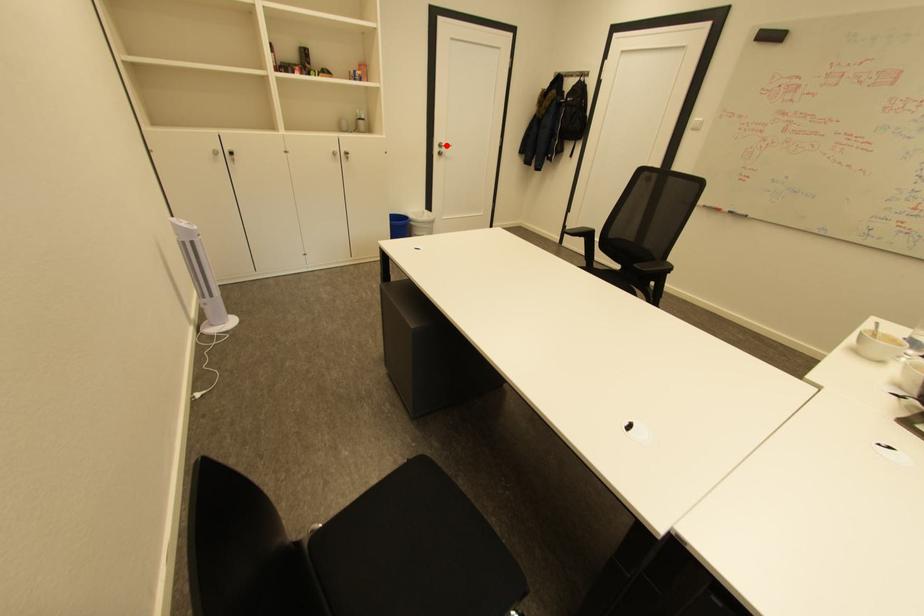
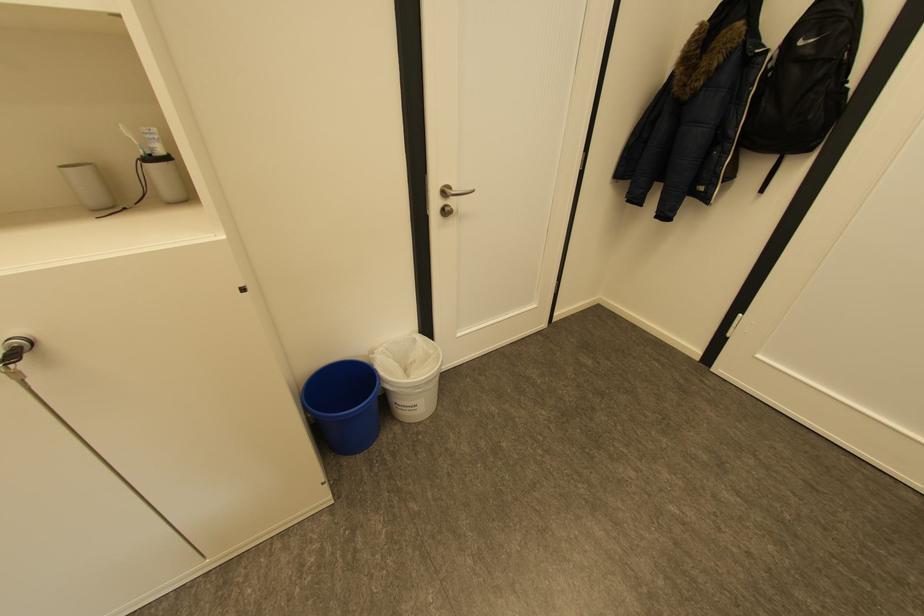
In the second image, find the point that corresponds to the highlighted location in the first image.

(451, 192)